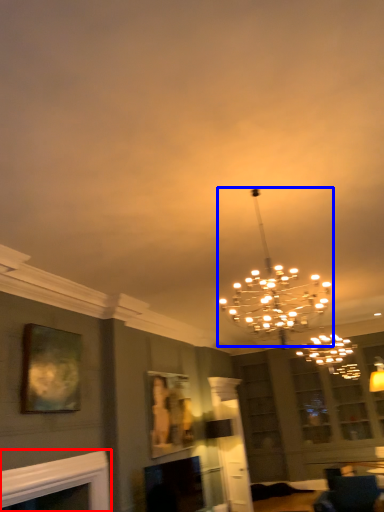
Question: Which point is closer to the camera, fireplace (highlighted by a red box) or lamp (highlighted by a blue box)?

Choices:
 (A) fireplace
 (B) lamp

Answer: (B)